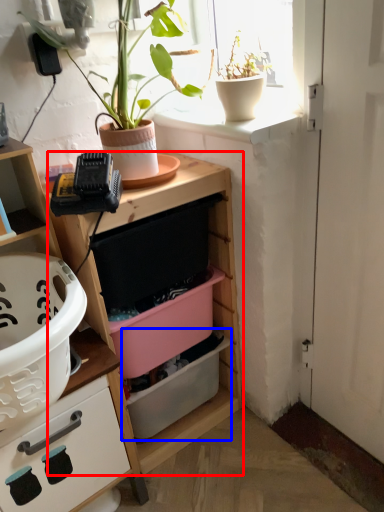
Question: Which point is further to the camera, shelf (highlighted by a red box) or storage box (highlighted by a blue box)?

Choices:
 (A) shelf
 (B) storage box

Answer: (B)